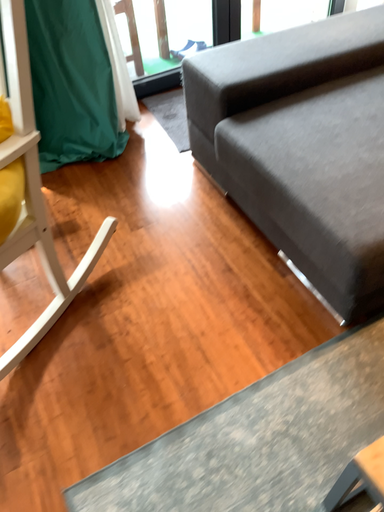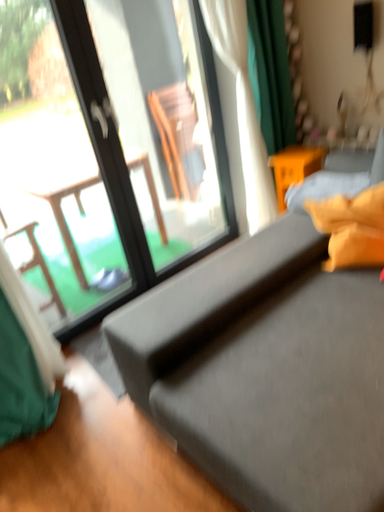
Question: How did the camera likely rotate when shooting the video?

Choices:
 (A) rotated upward
 (B) rotated downward

Answer: (A)